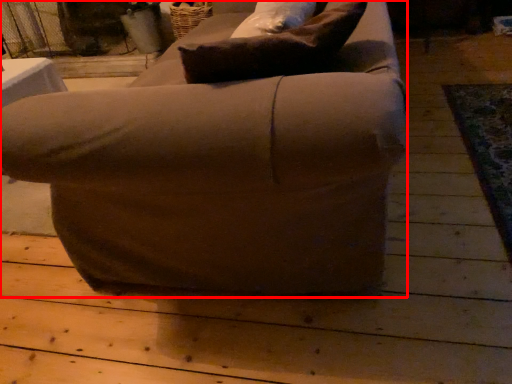
Question: In this image, where is chair (annotated by the red box) located relative to pillow?

Choices:
 (A) left
 (B) right

Answer: (A)